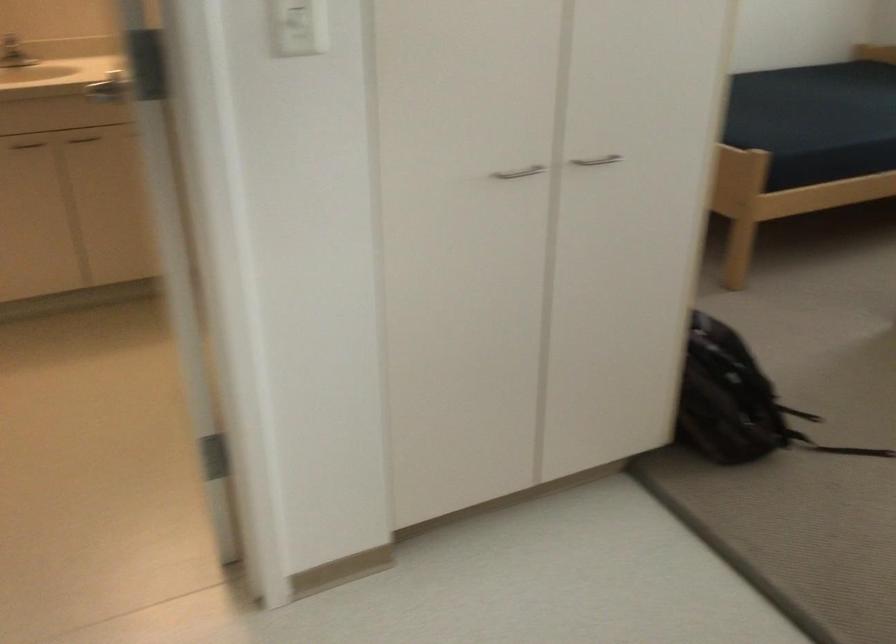
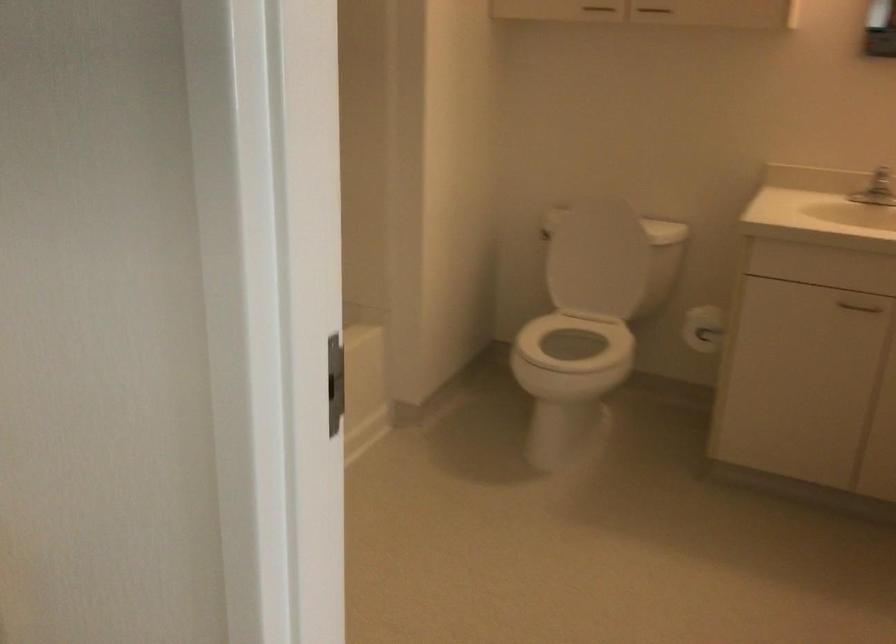
Question: The camera is either moving clockwise (left) or counter-clockwise (right) around the object. The first image is from the beginning of the video and the second image is from the end. Is the camera moving left or right when shooting the video?

Choices:
 (A) Left
 (B) Right

Answer: (B)